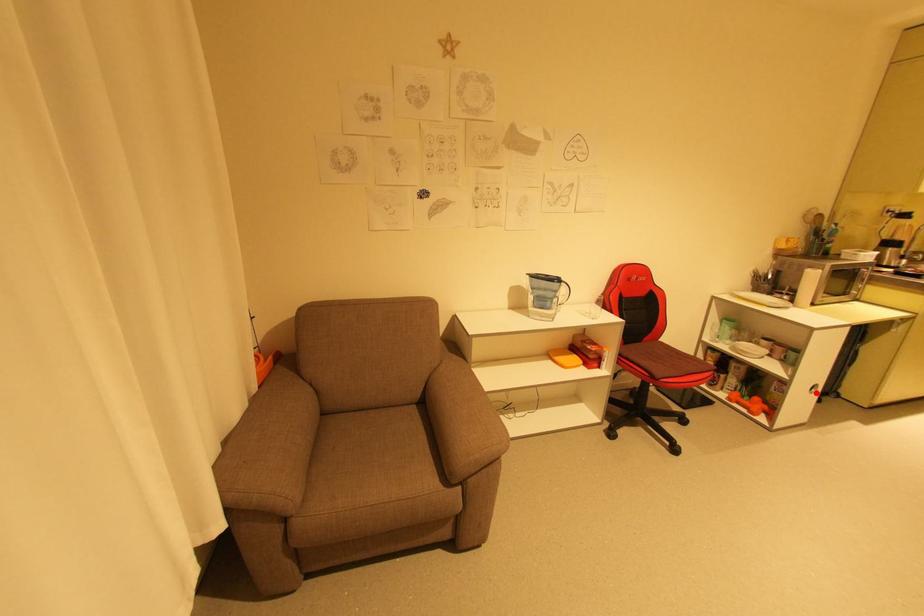
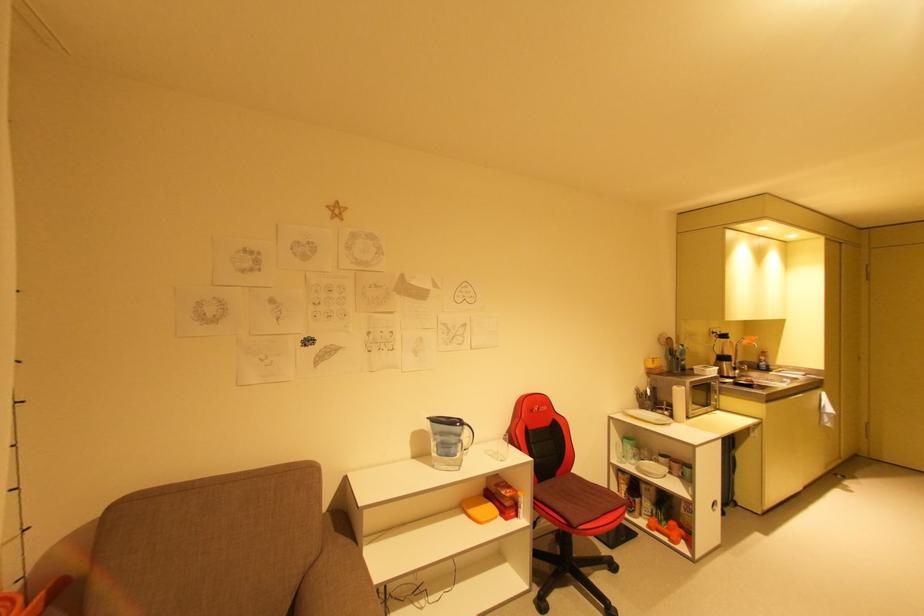
Where in the second image is the point corresponding to the highlighted location from the first image?

(718, 511)